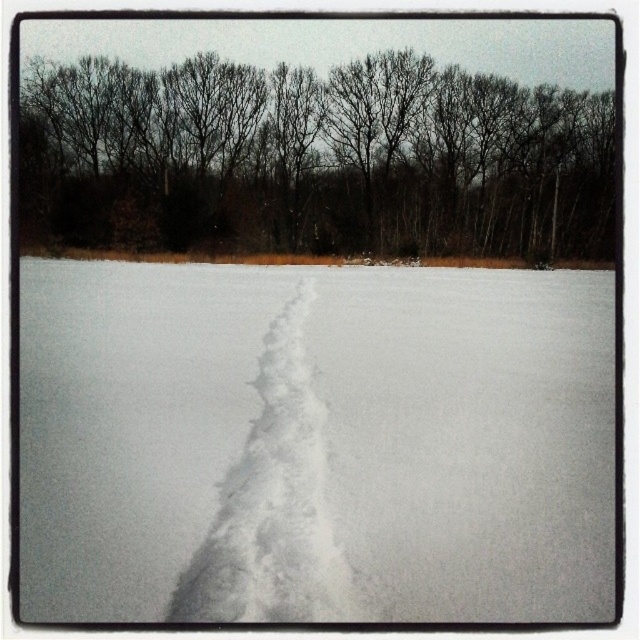
You are standing at the starting point of the path in the winter landscape. You see two points marked on the path ahead of you. The first point is at coordinates point (371, 141) and the second is at point (288, 426). Which point is closer to your current position?

Point (288, 426) is closer to your current position because it is in front of point (371, 141), which is further back along the path.

You are planning to take a photo of the winter landscape. You want to include both the bare branches at upper center and the white fluffy snow trail at center in your frame. Which object will appear bigger in the photo?

The bare branches at upper center will appear bigger in the photo because they have a larger size compared to the white fluffy snow trail at center.

You are an explorer in a winter wonderland. You see the bare branches at upper center and the white fluffy snow trail at center. Which object is positioned to the left of the other?

The bare branches at upper center are to the left of the white fluffy snow trail at center.